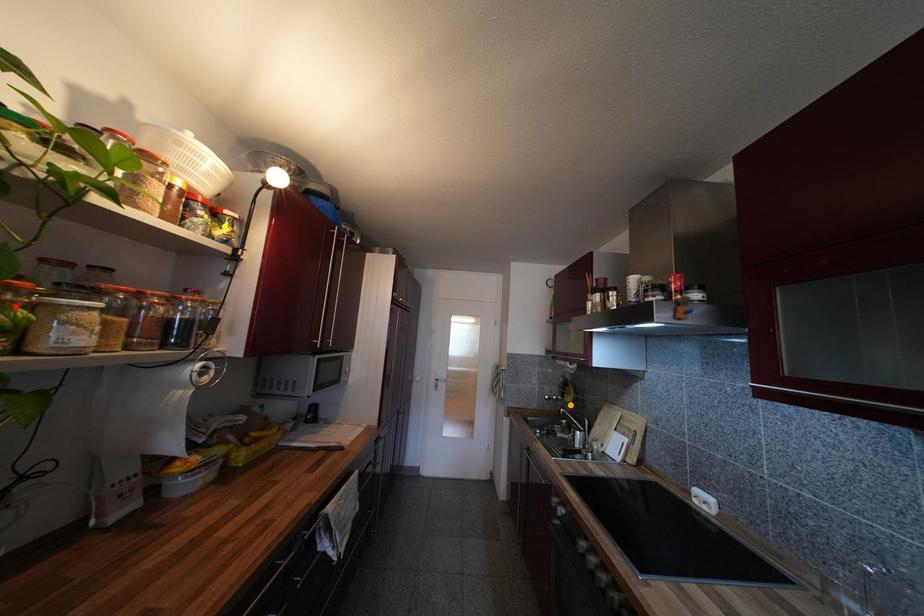
Order these from nearest to farthest:
orange point, yellow point, red point

orange point → yellow point → red point